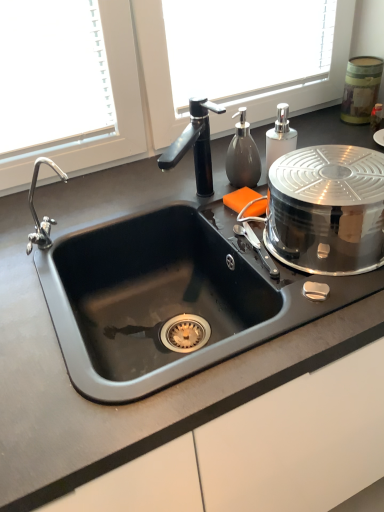
Question: Relative to matte gray soap dispenser at upper right, which appears as the first soap dispenser when viewed from the left, is metallic canister at upper right, the first appliance positioned from the right, in front or behind?

Choices:
 (A) front
 (B) behind

Answer: (B)

Question: From a real-world perspective, is metallic canister at upper right, placed as the second appliance when sorted from bottom to top, physically located above or below matte gray soap dispenser at upper right, the second soap dispenser from the right?

Choices:
 (A) above
 (B) below

Answer: (B)

Question: Based on their relative distances, which object is farther from the polished stainless steel lid at right, which is the 1th appliance from left to right?

Choices:
 (A) matte gray soap dispenser at upper right, which appears as the first soap dispenser when viewed from the left
 (B) white glossy soap dispenser at upper right, arranged as the first soap dispenser when viewed from the right
 (C) metallic canister at upper right, the first appliance positioned from the right

Answer: (C)

Question: Estimate the real-world distances between objects in this image. Which object is closer to the metallic canister at upper right, which is the 2th appliance in front-to-back order?

Choices:
 (A) white glossy soap dispenser at upper right, arranged as the first soap dispenser when viewed from the right
 (B) matte gray soap dispenser at upper right, the second soap dispenser from the right
 (C) polished stainless steel lid at right, the second appliance from the top

Answer: (A)